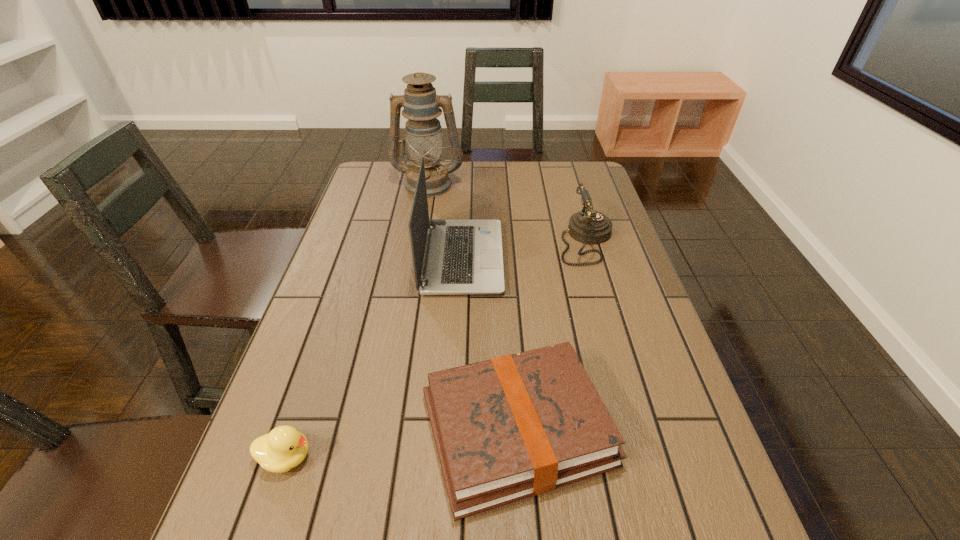
Identify which object is located as the second nearest to the laptop computer. Please provide its 2D coordinates. Your answer should be formatted as a tuple, i.e. [(x, y)], where the tuple contains the x and y coordinates of a point satisfying the conditions above.

[(588, 226)]

I want to click on vacant position in the image that satisfies the following two spatial constraints: 1. on the front side of the telephone; 2. on the beak of the duckling, so click(x=648, y=457).

Where is `vacant space that satisfies the following two spatial constraints: 1. on the front side of the hardback book; 2. on the beak of the duckling`? vacant space that satisfies the following two spatial constraints: 1. on the front side of the hardback book; 2. on the beak of the duckling is located at coordinates (x=519, y=457).

Where is `free space that satisfies the following two spatial constraints: 1. on the front side of the hardback book; 2. on the beak of the duckling`? The height and width of the screenshot is (540, 960). free space that satisfies the following two spatial constraints: 1. on the front side of the hardback book; 2. on the beak of the duckling is located at coordinates (519, 457).